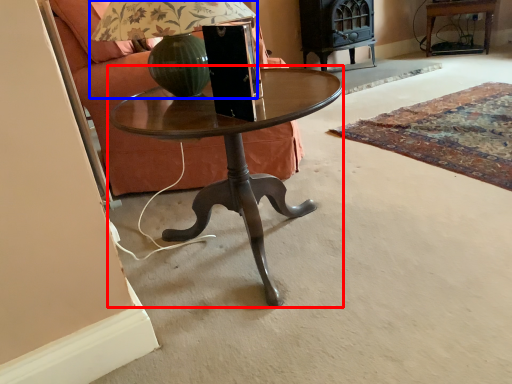
Question: Which object is further to the camera taking this photo, coffee table (highlighted by a red box) or table lamp (highlighted by a blue box)?

Choices:
 (A) coffee table
 (B) table lamp

Answer: (B)